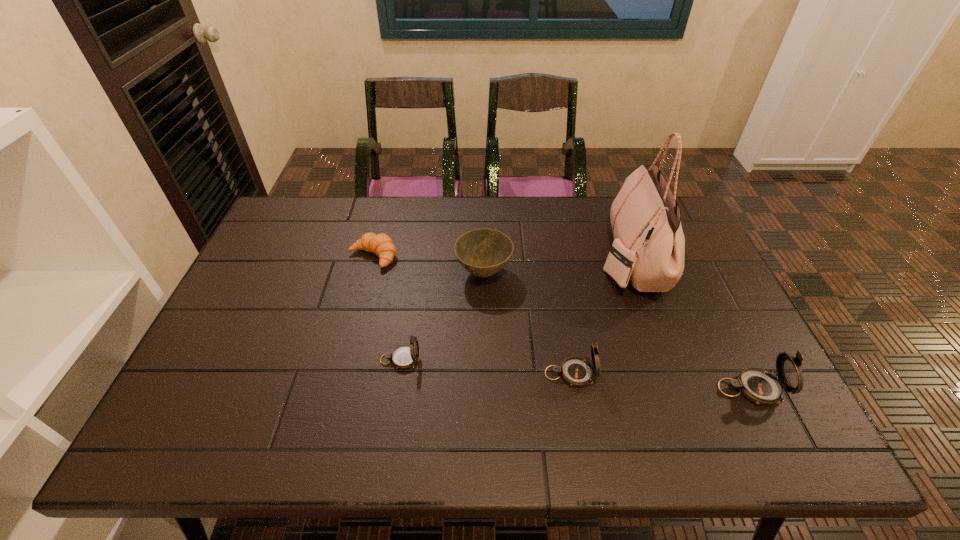
The height and width of the screenshot is (540, 960). What are the coordinates of `handbag at the right edge` in the screenshot? It's located at (649, 245).

Locate an element on the screen. The height and width of the screenshot is (540, 960). object located at the far right corner is located at coordinates (649, 245).

Find the location of `object situated at the near right corner`. object situated at the near right corner is located at coordinates (758, 385).

In the image, there is a desktop. Where is `vacant region at the far edge`? The image size is (960, 540). vacant region at the far edge is located at coordinates (551, 208).

In the image, there is a desktop. Where is `vacant area at the near edge`? Image resolution: width=960 pixels, height=540 pixels. vacant area at the near edge is located at coordinates (425, 383).

In the image, there is a desktop. Identify the location of vacant space at the right edge. The image size is (960, 540). (734, 334).

I want to click on free spot at the near left corner of the desktop, so click(191, 386).

Locate an element on the screen. free space that is in between the rightmost object and the shortest object is located at coordinates (562, 322).

Locate an element on the screen. free point between the handbag and the shortest compass is located at coordinates (516, 309).

Locate an element on the screen. free spot between the handbag and the rightmost object is located at coordinates (690, 323).